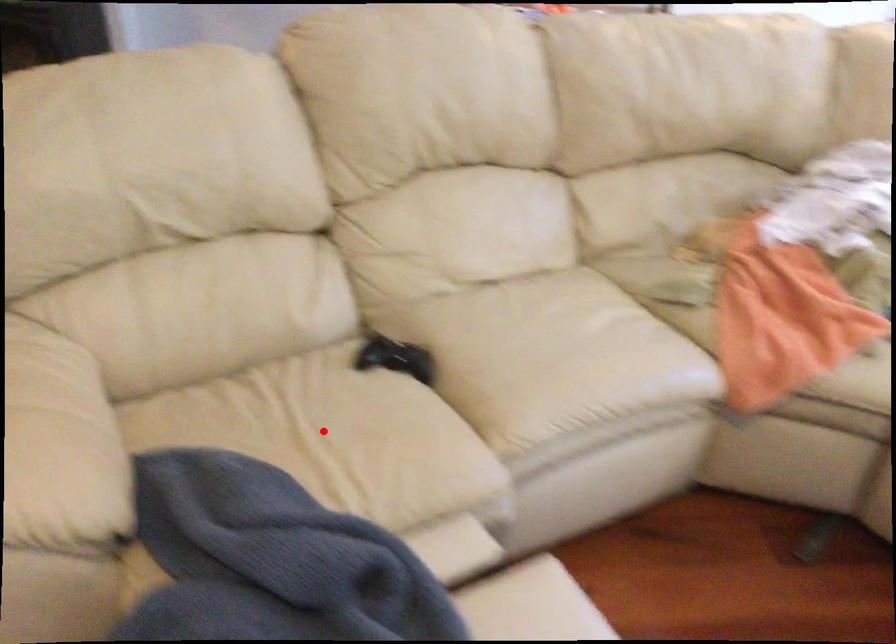
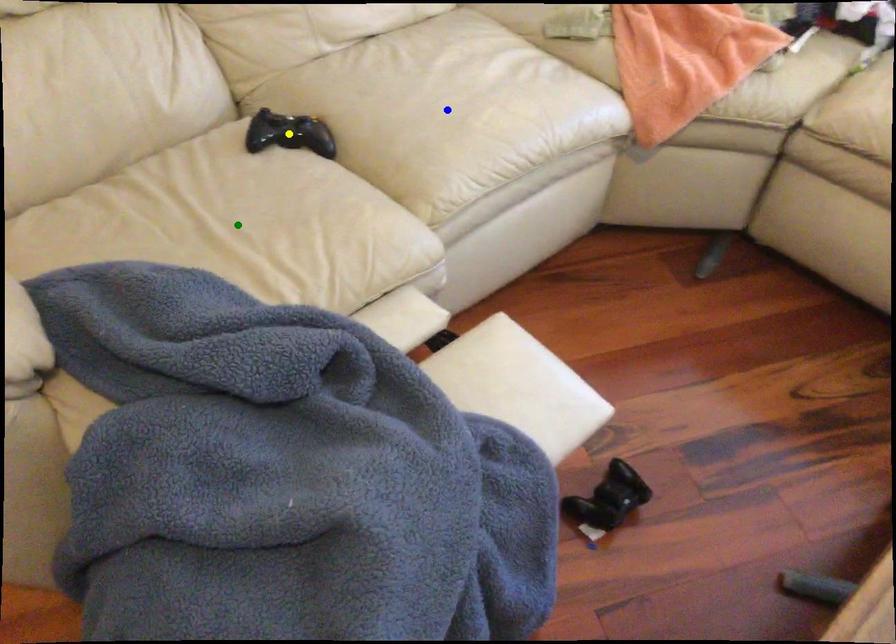
Question: I am providing you with two images of the same scene from different viewpoints. A red point is marked on the first image. You are given multiple points on the second image. In image 2, which mark is for the same physical point as the one in image 1?

Choices:
 (A) blue point
 (B) green point
 (C) yellow point

Answer: (B)